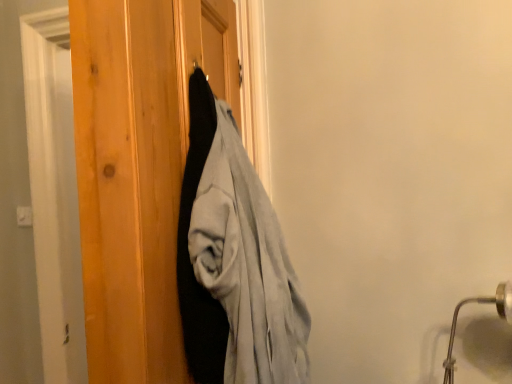
At what (x,y) coordinates should I click in order to perform the action: click on matte black coat at center. Please return your answer as a coordinate pair (x, y). Looking at the image, I should click on (188, 242).

Image resolution: width=512 pixels, height=384 pixels. What do you see at coordinates (188, 242) in the screenshot?
I see `matte black coat at center` at bounding box center [188, 242].

Locate an element on the screen. The image size is (512, 384). silver metallic door handle at lower right is located at coordinates (479, 303).

What is the approximate width of silver metallic door handle at lower right?

The width of silver metallic door handle at lower right is 7.55 inches.

Describe the element at coordinates (479, 303) in the screenshot. Image resolution: width=512 pixels, height=384 pixels. I see `silver metallic door handle at lower right` at that location.

This screenshot has height=384, width=512. I want to click on matte black coat at center, so click(x=188, y=242).

Would you say matte black coat at center is to the left or to the right of silver metallic door handle at lower right in the picture?

In the image, matte black coat at center appears on the left side of silver metallic door handle at lower right.

Which object is further away from the camera taking this photo, matte black coat at center or silver metallic door handle at lower right?

Positioned behind is silver metallic door handle at lower right.

Which is farther, (178, 262) or (449, 376)?

The point (449, 376) is farther from the camera.

From the image's perspective, is matte black coat at center positioned above or below silver metallic door handle at lower right?

matte black coat at center is above silver metallic door handle at lower right.

From a real-world perspective, is matte black coat at center above or below silver metallic door handle at lower right?

Clearly, from a real-world perspective, matte black coat at center is above silver metallic door handle at lower right.

Which object is wider, matte black coat at center or silver metallic door handle at lower right?

silver metallic door handle at lower right is wider.

Can you confirm if matte black coat at center is taller than silver metallic door handle at lower right?

Yes, matte black coat at center is taller than silver metallic door handle at lower right.

Who is smaller, matte black coat at center or silver metallic door handle at lower right?

With smaller size is silver metallic door handle at lower right.

Can we say matte black coat at center lies outside silver metallic door handle at lower right?

Absolutely, matte black coat at center is external to silver metallic door handle at lower right.

Is there a large distance between matte black coat at center and silver metallic door handle at lower right?

No.

Is matte black coat at center looking in the opposite direction of silver metallic door handle at lower right?

No, matte black coat at center is not facing the opposite direction of silver metallic door handle at lower right.

How many degrees apart are the facing directions of matte black coat at center and silver metallic door handle at lower right?

They differ by 85.5 degrees in their facing directions.

Image resolution: width=512 pixels, height=384 pixels. What are the coordinates of `door handle directly beneath the matte black coat at center (from a real-world perspective)` in the screenshot? It's located at (479, 303).

Is silver metallic door handle at lower right to the left of matte black coat at center from the viewer's perspective?

Incorrect, silver metallic door handle at lower right is not on the left side of matte black coat at center.

Considering the positions of objects silver metallic door handle at lower right and matte black coat at center in the image provided, who is in front, silver metallic door handle at lower right or matte black coat at center?

matte black coat at center is more forward.

Between point (452, 320) and point (195, 157), which one is positioned in front?

The point (195, 157) is closer.

Looking at this image, from the image's perspective, is silver metallic door handle at lower right below matte black coat at center?

Yes, from the image's perspective, silver metallic door handle at lower right is below matte black coat at center.

From a real-world perspective, which object rests below the other?

silver metallic door handle at lower right, from a real-world perspective.

Does silver metallic door handle at lower right have a lesser width compared to matte black coat at center?

No.

Is silver metallic door handle at lower right taller than matte black coat at center?

No, silver metallic door handle at lower right is not taller than matte black coat at center.

Considering the sizes of objects silver metallic door handle at lower right and matte black coat at center in the image provided, who is bigger, silver metallic door handle at lower right or matte black coat at center?

matte black coat at center is bigger.

Is matte black coat at center inside silver metallic door handle at lower right?

No, matte black coat at center is not a part of silver metallic door handle at lower right.

Is silver metallic door handle at lower right far from matte black coat at center?

They are positioned close to each other.

Is silver metallic door handle at lower right aimed at matte black coat at center?

No, silver metallic door handle at lower right is not aimed at matte black coat at center.

Locate an element on the screen. door handle that is below the matte black coat at center (from the image's perspective) is located at coordinates (479, 303).

Locate an element on the screen. The image size is (512, 384). barn door on the left of silver metallic door handle at lower right is located at coordinates (188, 242).

Where is `door handle below the matte black coat at center (from the image's perspective)`? The width and height of the screenshot is (512, 384). door handle below the matte black coat at center (from the image's perspective) is located at coordinates (479, 303).